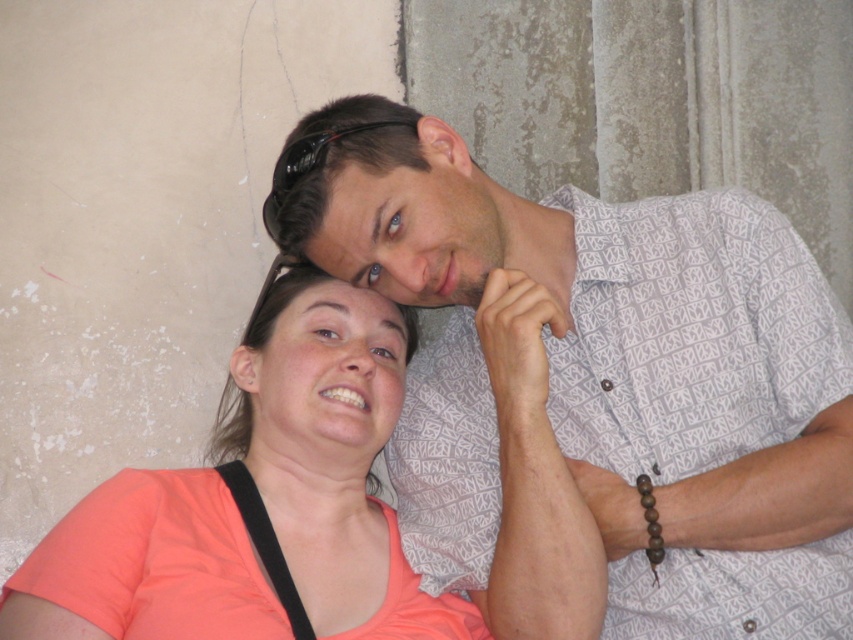
Locate an element on the screen. Image resolution: width=853 pixels, height=640 pixels. white printed shirt at upper center is located at coordinates (604, 372).

Between white printed shirt at upper center and coral matte shirt at center, which one is positioned higher?

white printed shirt at upper center is higher up.

Who is more forward, [541,234] or [451,625]?

Positioned in front is point [451,625].

Where is `white printed shirt at upper center`? This screenshot has width=853, height=640. white printed shirt at upper center is located at coordinates (604, 372).